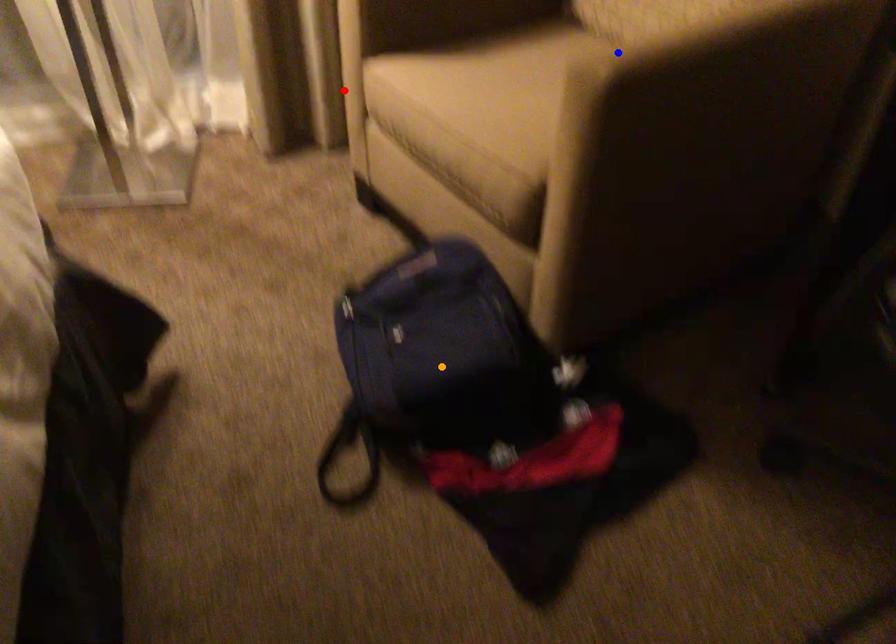
Order these from nearest to farthest:
blue point
orange point
red point

blue point → orange point → red point